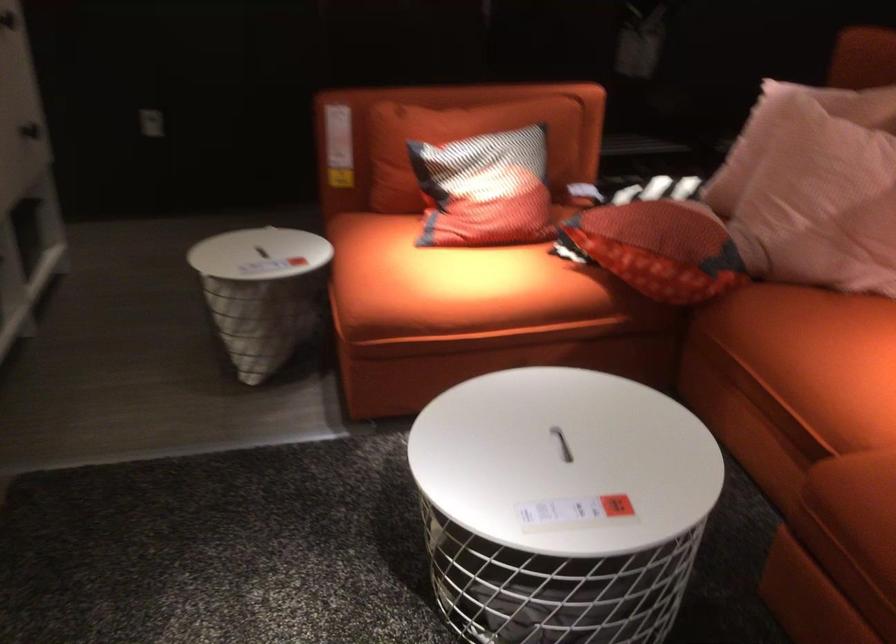
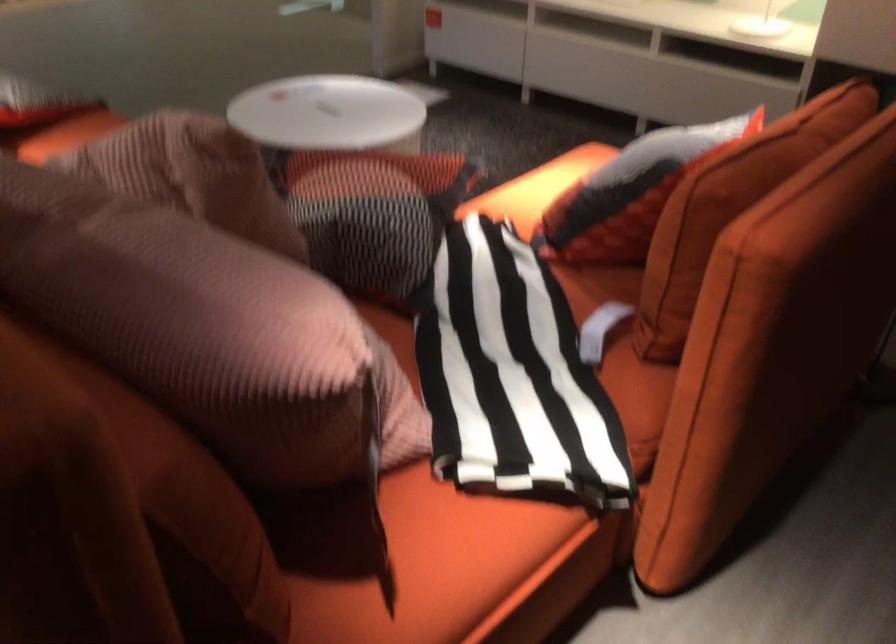
In the second image, find the point that corresponds to the point at 564,100 in the first image.

(730, 207)